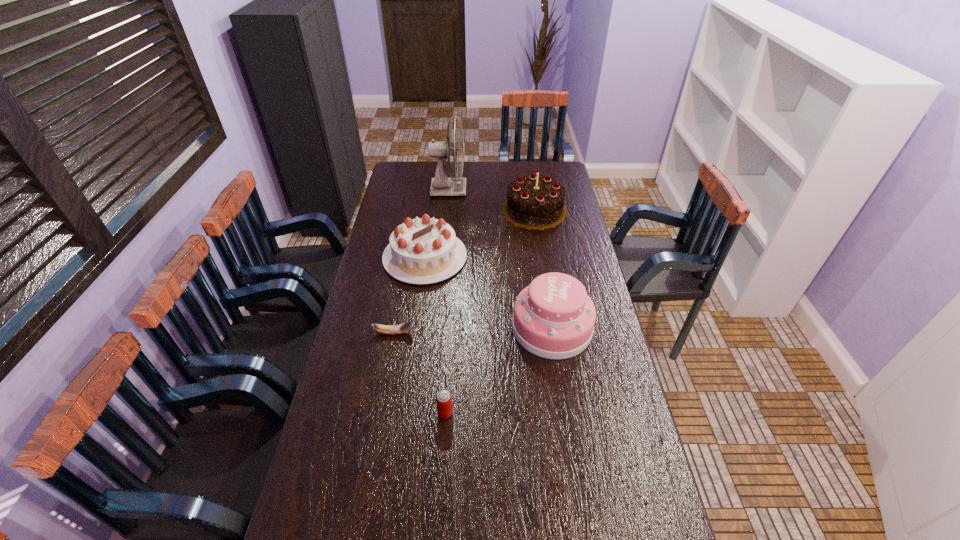
Where is `free space located on the right of the fourth nearest object`? This screenshot has height=540, width=960. free space located on the right of the fourth nearest object is located at coordinates (559, 257).

Identify the location of free point located 0.090m on the front of the beer can. Image resolution: width=960 pixels, height=540 pixels. [x=443, y=450].

You are a GUI agent. You are given a task and a screenshot of the screen. Output one action in this format:
    pyautogui.click(x=<x>, y=<y>)
    Task: Click on the vacant space located 0.060m at the stem of the banana
    The height and width of the screenshot is (540, 960).
    Given the screenshot: What is the action you would take?
    pyautogui.click(x=433, y=333)

Identify the location of object positioned at the far edge. (441, 185).

Locate an element on the screen. The height and width of the screenshot is (540, 960). birthday cake situated at the left edge is located at coordinates (421, 251).

Find the location of `banana situated at the left edge`. banana situated at the left edge is located at coordinates (405, 327).

In the image, there is a desktop. At what (x,y) coordinates should I click in order to perform the action: click on vacant space at the far edge. Please return your answer as a coordinate pair (x, y). Looking at the image, I should click on (502, 162).

In order to click on vacant region at the left edge in this screenshot , I will do `click(389, 228)`.

In the image, there is a desktop. Identify the location of vacant space at the right edge. (597, 280).

Locate an element on the screen. This screenshot has width=960, height=540. vacant region between the nearest object and the tallest object is located at coordinates (447, 301).